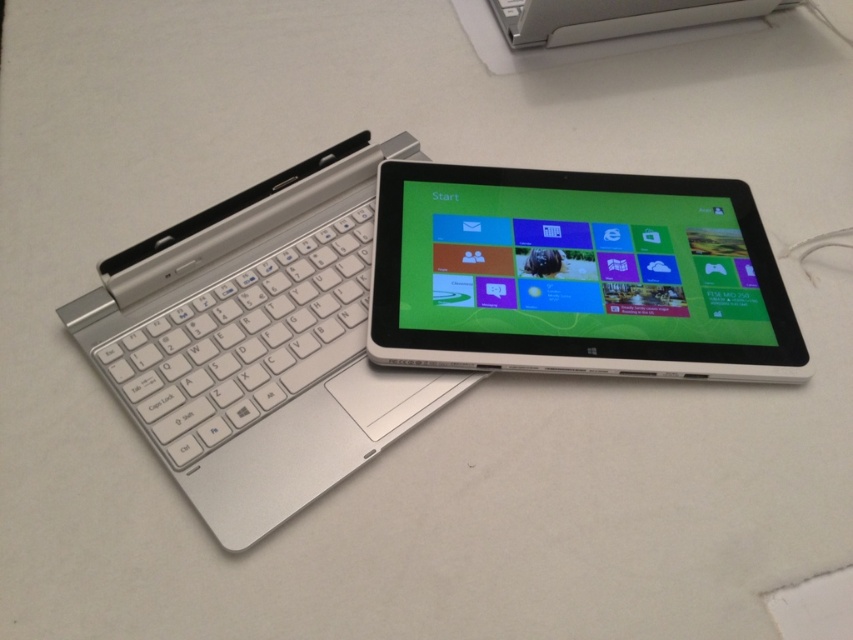
Question: Does silver metallic laptop at upper left appear under silver metallic keyboard at left?

Choices:
 (A) no
 (B) yes

Answer: (A)

Question: Which point appears closest to the camera in this image?

Choices:
 (A) (334, 292)
 (B) (560, 214)
 (C) (335, 253)

Answer: (A)

Question: Which object is the farthest from the silver metallic laptop at upper left?

Choices:
 (A) silver metallic keyboard at left
 (B) white plastic tablet at center

Answer: (B)

Question: Does silver metallic laptop at upper left have a lesser width compared to white plastic tablet at center?

Choices:
 (A) yes
 (B) no

Answer: (A)

Question: Is the position of white plastic tablet at center less distant than that of silver metallic keyboard at left?

Choices:
 (A) no
 (B) yes

Answer: (A)

Question: Which point is closer to the camera?

Choices:
 (A) (267, 301)
 (B) (749, 288)
 (C) (216, 332)

Answer: (C)